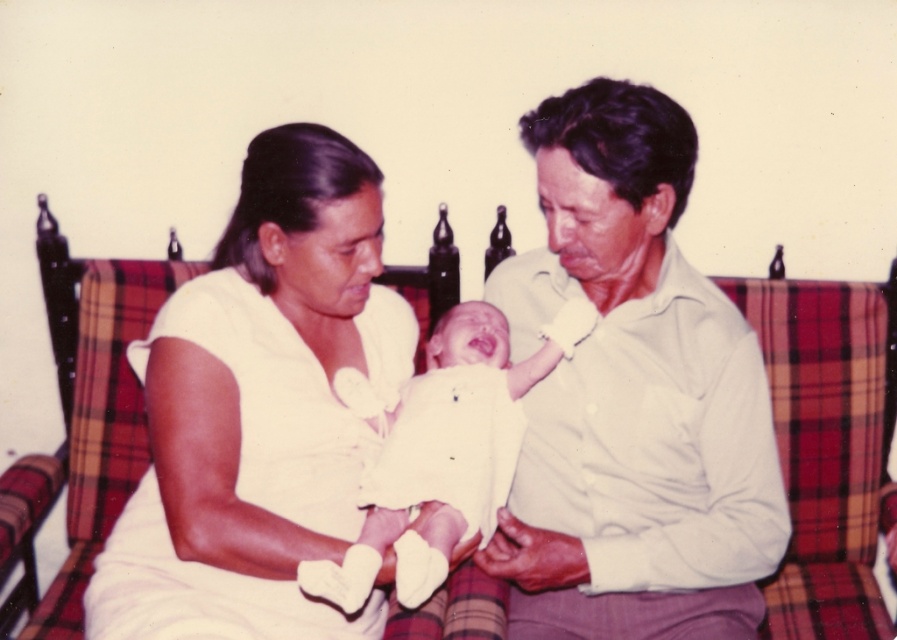
Question: Which object is positioned closest to the plaid fabric couch at center?

Choices:
 (A) white cotton shirt at center
 (B) white fabric dress at center
 (C) white soft fabric baby at center

Answer: (A)

Question: Which object is positioned farthest from the white fabric dress at center?

Choices:
 (A) plaid fabric couch at center
 (B) white soft fabric baby at center
 (C) white cotton shirt at center

Answer: (A)

Question: Can you confirm if white cotton shirt at center is bigger than white soft fabric baby at center?

Choices:
 (A) no
 (B) yes

Answer: (B)

Question: Observing the image, what is the correct spatial positioning of plaid fabric couch at center in reference to white soft fabric baby at center?

Choices:
 (A) left
 (B) right

Answer: (B)

Question: Which object is farther from the camera taking this photo?

Choices:
 (A) white soft fabric baby at center
 (B) white fabric dress at center
 (C) white cotton shirt at center
 (D) plaid fabric couch at center

Answer: (D)

Question: Does plaid fabric couch at center have a smaller size compared to white soft fabric baby at center?

Choices:
 (A) yes
 (B) no

Answer: (A)